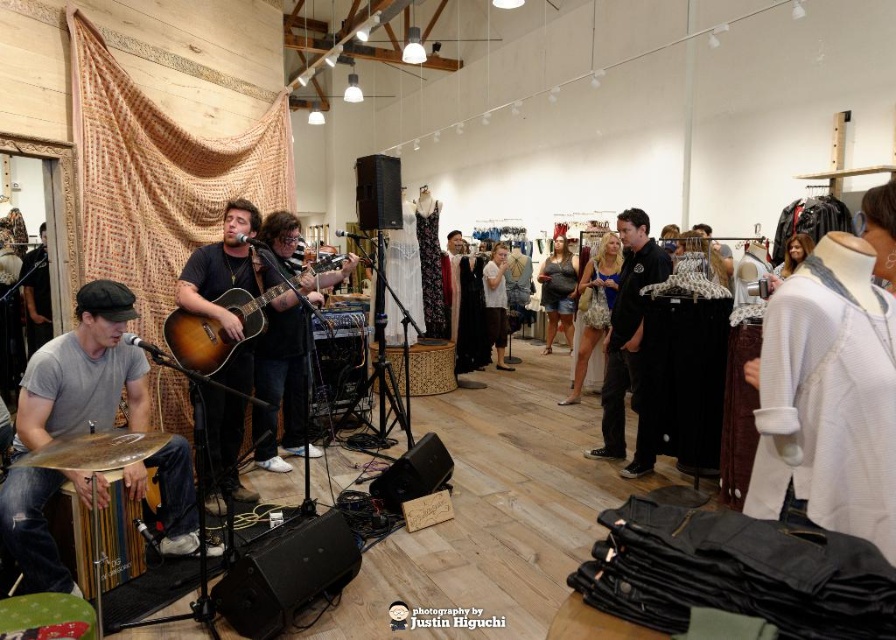
Question: Observing the image, what is the correct spatial positioning of gray matte t-shirt at left in reference to light gray sweater at center?

Choices:
 (A) above
 (B) below

Answer: (B)

Question: Is sunburst wood acoustic guitar at center smaller than light gray sweater at center?

Choices:
 (A) no
 (B) yes

Answer: (B)

Question: Is the position of gray matte t-shirt at left less distant than that of light gray sweater at center?

Choices:
 (A) no
 (B) yes

Answer: (B)

Question: Which object appears closest to the camera in this image?

Choices:
 (A) matte gray tank top at center
 (B) light gray sweater at center
 (C) gray matte t-shirt at left
 (D) sunburst wood acoustic guitar at center

Answer: (C)

Question: Among these objects, which one is farthest from the camera?

Choices:
 (A) patterned fabric dress at center
 (B) black matte jacket at center
 (C) gray matte t-shirt at left

Answer: (A)

Question: Which object appears closest to the camera in this image?

Choices:
 (A) gray matte t-shirt at left
 (B) light gray sweater at center
 (C) matte gray tank top at center

Answer: (A)